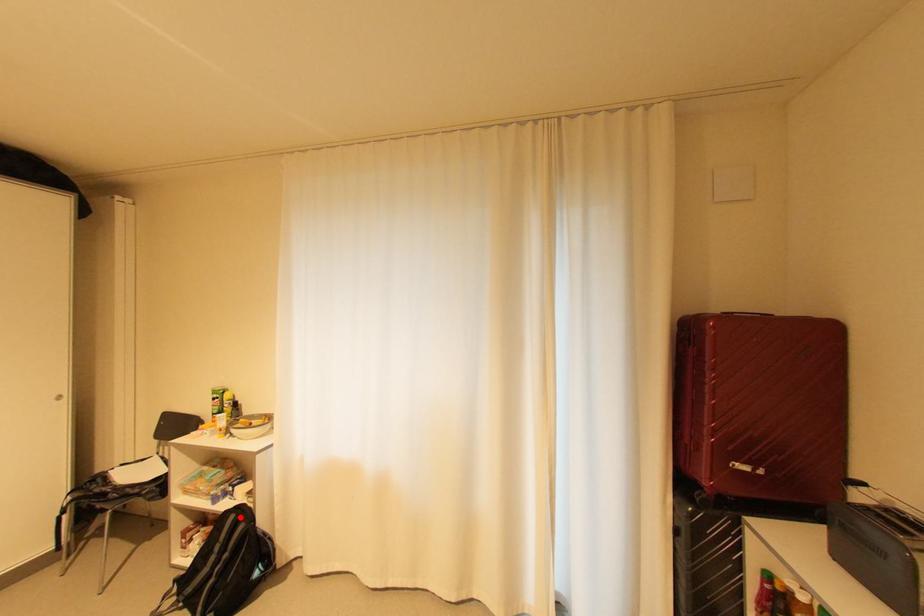
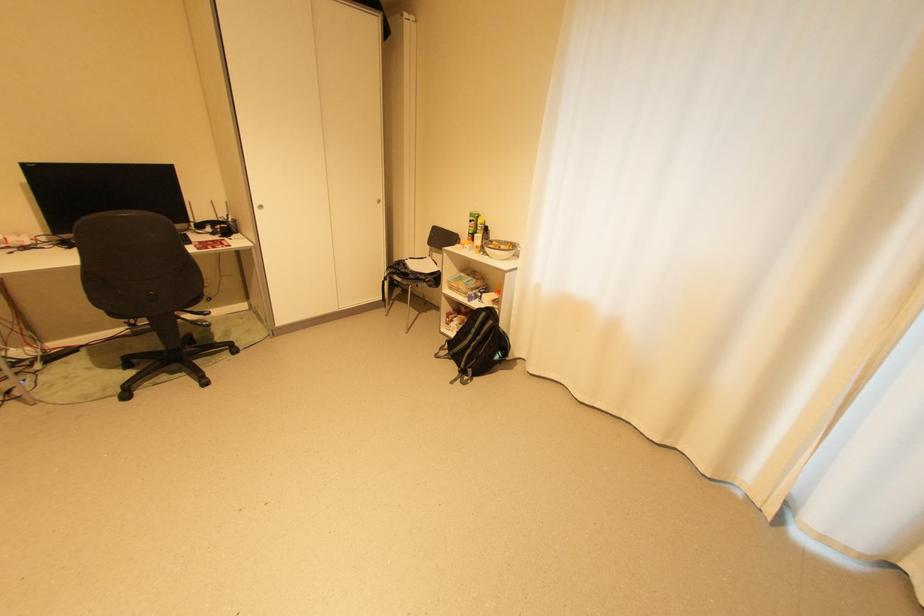
In the second image, find the point that corresponds to the highlighted location in the first image.

(492, 314)